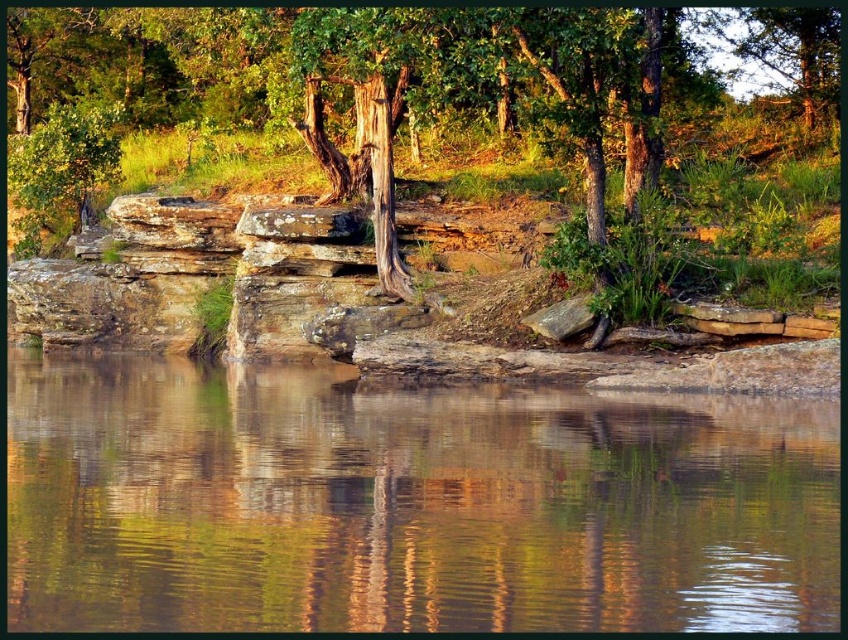
You are standing on the rocky shoreline and want to cross to the other side. You see the green reflective water at center and the smooth bark tree at center. Which one is closer to you?

The green reflective water at center is closer to you since it has a smaller size compared to the smooth bark tree at center, indicating it is nearer in the scene.